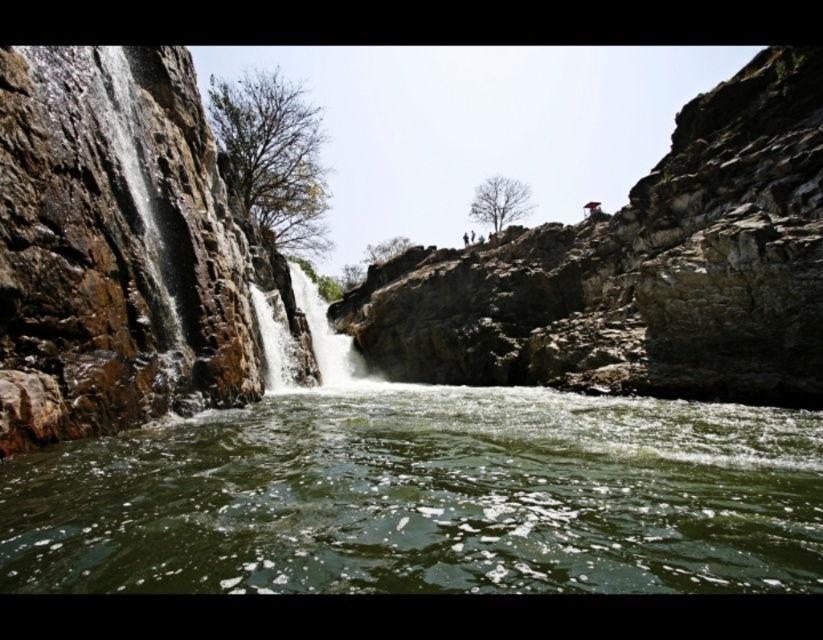
Question: Does brown rough rock face at left have a larger size compared to translucent white water at center?

Choices:
 (A) yes
 (B) no

Answer: (A)

Question: Which point is closer to the camera?

Choices:
 (A) (307, 480)
 (B) (267, 356)
 (C) (45, 65)

Answer: (C)

Question: Estimate the real-world distances between objects in this image. Which object is closer to the translucent white water at center?

Choices:
 (A) green smooth river at center
 (B) brown rough rock face at left
 (C) smooth white water at center
 (D) brown rocky cliff at upper center

Answer: (C)

Question: Which object appears farthest from the camera in this image?

Choices:
 (A) translucent white water at center
 (B) brown rocky cliff at upper center

Answer: (A)

Question: Does brown rocky cliff at upper center appear under brown rough rock face at left?

Choices:
 (A) no
 (B) yes

Answer: (B)

Question: Is brown rough rock face at left to the right of smooth white water at center from the viewer's perspective?

Choices:
 (A) no
 (B) yes

Answer: (A)